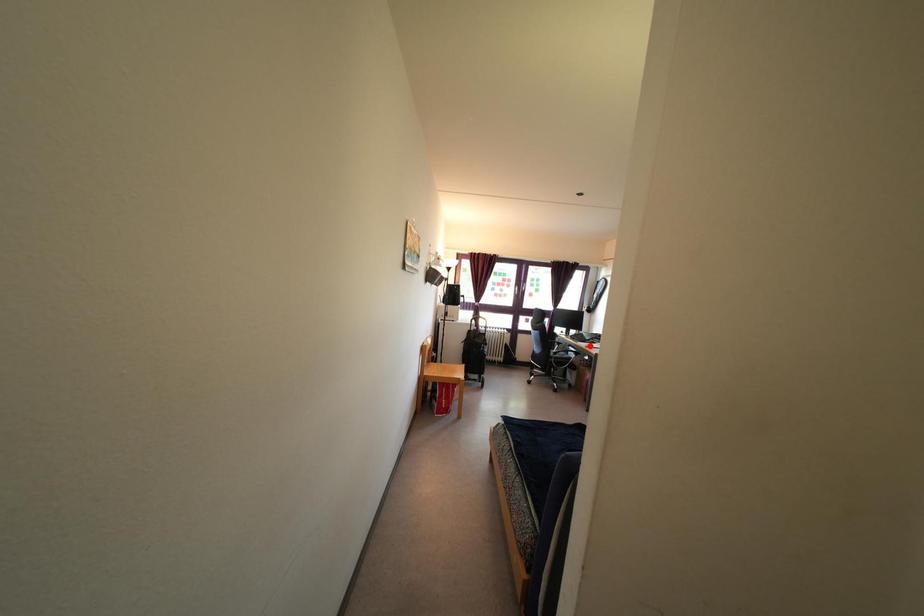
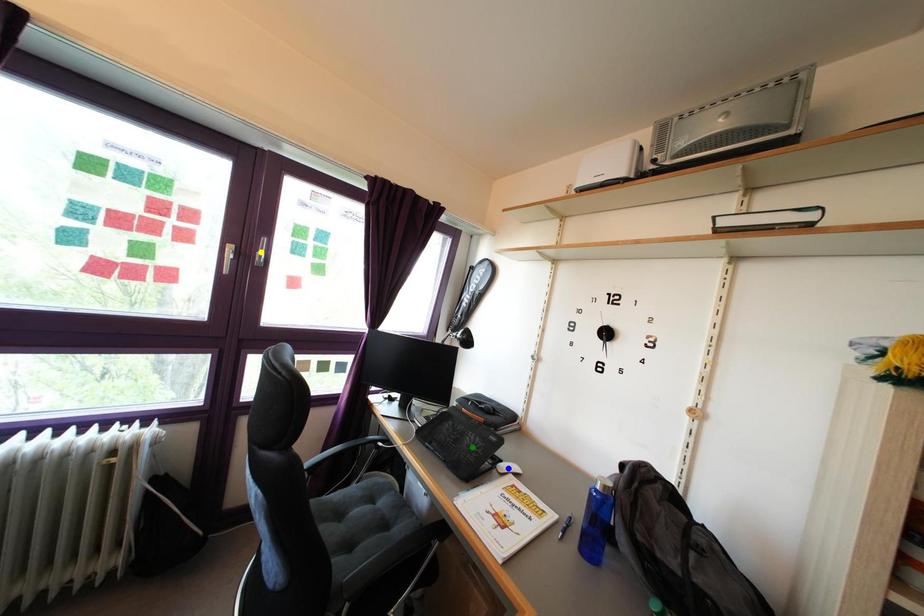
Question: I am providing you with two images of the same scene from different viewpoints. A red point is marked on the first image. You are given multiple points on the second image. Which point in image 2 is actually the same real-world point as the red point in image 1?

Choices:
 (A) green point
 (B) blue point
 (C) yellow point

Answer: (A)